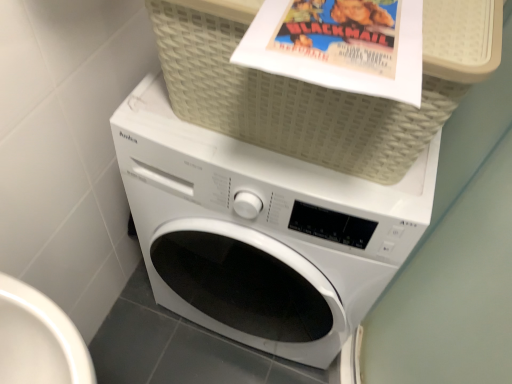
What is the approximate height of beige woven basket at upper center?

It is 11.01 inches.

At what (x,y) coordinates should I click in order to perform the action: click on beige woven basket at upper center. Please return your answer as a coordinate pair (x, y). This screenshot has height=384, width=512. Looking at the image, I should click on (319, 87).

This screenshot has width=512, height=384. What do you see at coordinates (319, 87) in the screenshot?
I see `beige woven basket at upper center` at bounding box center [319, 87].

In order to face beige woven basket at upper center, should I rotate leftwards or rightwards?

A 8.700 degree turn to the right will do.

In order to face white matte washing machine at center, should I rotate leftwards or rightwards?

You should rotate right by 1.625 degrees.

The width and height of the screenshot is (512, 384). What do you see at coordinates (261, 231) in the screenshot? I see `white matte washing machine at center` at bounding box center [261, 231].

The image size is (512, 384). I want to click on white matte washing machine at center, so click(x=261, y=231).

Locate an element on the screen. The width and height of the screenshot is (512, 384). beige woven basket at upper center is located at coordinates (319, 87).

Visually, is white matte washing machine at center positioned to the left or to the right of beige woven basket at upper center?

white matte washing machine at center is positioned on beige woven basket at upper center's left side.

Considering the relative positions of white matte washing machine at center and beige woven basket at upper center in the image provided, is white matte washing machine at center behind beige woven basket at upper center?

Yes, white matte washing machine at center is further from the viewer.

Which is closer, (380, 228) or (357, 175)?

Point (380, 228) is positioned closer to the camera compared to point (357, 175).

From the image's perspective, would you say white matte washing machine at center is positioned over beige woven basket at upper center?

Actually, white matte washing machine at center appears below beige woven basket at upper center in the image.

From a real-world perspective, between white matte washing machine at center and beige woven basket at upper center, who is vertically lower?

white matte washing machine at center.

Which of these two, white matte washing machine at center or beige woven basket at upper center, is thinner?

beige woven basket at upper center is thinner.

From the picture: Who is shorter, white matte washing machine at center or beige woven basket at upper center?

With less height is beige woven basket at upper center.

Considering the sizes of objects white matte washing machine at center and beige woven basket at upper center in the image provided, who is bigger, white matte washing machine at center or beige woven basket at upper center?

With larger size is white matte washing machine at center.

Is beige woven basket at upper center completely or partially inside white matte washing machine at center?

That's incorrect, beige woven basket at upper center is not inside white matte washing machine at center.

Consider the image. Would you say white matte washing machine at center is a long distance from beige woven basket at upper center?

That's not correct — white matte washing machine at center is a little close to beige woven basket at upper center.

Is white matte washing machine at center oriented towards beige woven basket at upper center?

No, white matte washing machine at center is not facing towards beige woven basket at upper center.

Can you tell me how much white matte washing machine at center and beige woven basket at upper center differ in facing direction?

There is a 0.000122-degree angle between the facing directions of white matte washing machine at center and beige woven basket at upper center.

Find the location of a particular element. This screenshot has height=384, width=512. washing machine located behind the beige woven basket at upper center is located at coordinates (261, 231).

Considering the positions of objects beige woven basket at upper center and white matte washing machine at center in the image provided, who is more to the left, beige woven basket at upper center or white matte washing machine at center?

white matte washing machine at center is more to the left.

Between beige woven basket at upper center and white matte washing machine at center, which one is positioned in front?

Positioned in front is beige woven basket at upper center.

Based on the photo, which point is more forward, (218, 91) or (150, 159)?

Positioned in front is point (218, 91).

From the image's perspective, is beige woven basket at upper center located above white matte washing machine at center?

Correct, beige woven basket at upper center appears higher than white matte washing machine at center in the image.

From a real-world perspective, between beige woven basket at upper center and white matte washing machine at center, who is vertically higher?

beige woven basket at upper center is physically above.

Between beige woven basket at upper center and white matte washing machine at center, which one has larger width?

Wider between the two is white matte washing machine at center.

Is beige woven basket at upper center taller or shorter than white matte washing machine at center?

beige woven basket at upper center is shorter than white matte washing machine at center.

Who is smaller, beige woven basket at upper center or white matte washing machine at center?

beige woven basket at upper center.

Could white matte washing machine at center be considered to be inside beige woven basket at upper center?

Actually, white matte washing machine at center is outside beige woven basket at upper center.

Is there a large distance between beige woven basket at upper center and white matte washing machine at center?

beige woven basket at upper center is near white matte washing machine at center, not far away.

Is white matte washing machine at center at the back of beige woven basket at upper center?

No.

Measure the distance from beige woven basket at upper center to white matte washing machine at center.

beige woven basket at upper center is 19.28 centimeters from white matte washing machine at center.

Image resolution: width=512 pixels, height=384 pixels. Identify the location of washing machine below the beige woven basket at upper center (from the image's perspective). (261, 231).

The height and width of the screenshot is (384, 512). In the image, there is a beige woven basket at upper center. Identify the location of washing machine below it (from a real-world perspective). (261, 231).

This screenshot has width=512, height=384. What are the coordinates of `basket on the right of white matte washing machine at center` in the screenshot? It's located at (319, 87).